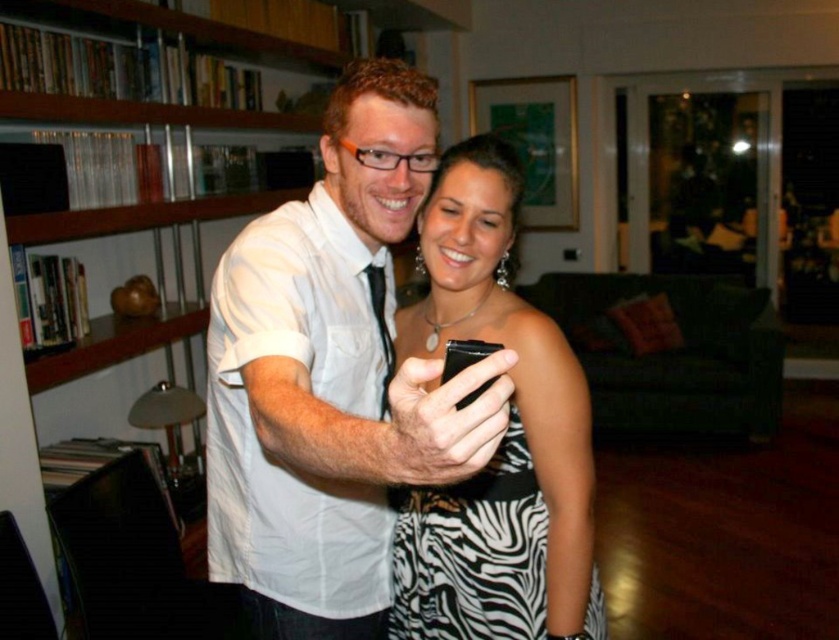
Question: Among these points, which one is nearest to the camera?

Choices:
 (A) (418, 454)
 (B) (452, 180)

Answer: (A)

Question: Which point is closer to the camera?

Choices:
 (A) zebra print dress at center
 (B) white matte shirt at center

Answer: (B)

Question: Can you confirm if wooden bookshelf at upper left is positioned to the left of zebra print dress at center?

Choices:
 (A) no
 (B) yes

Answer: (B)

Question: Which object appears closest to the camera in this image?

Choices:
 (A) black matte smartphone at center
 (B) white matte shirt at center
 (C) wooden bookshelf at upper left

Answer: (B)

Question: Is white matte shirt at center to the left of black matte smartphone at center from the viewer's perspective?

Choices:
 (A) yes
 (B) no

Answer: (A)

Question: Does wooden bookshelf at upper left appear on the right side of black matte smartphone at center?

Choices:
 (A) yes
 (B) no

Answer: (B)